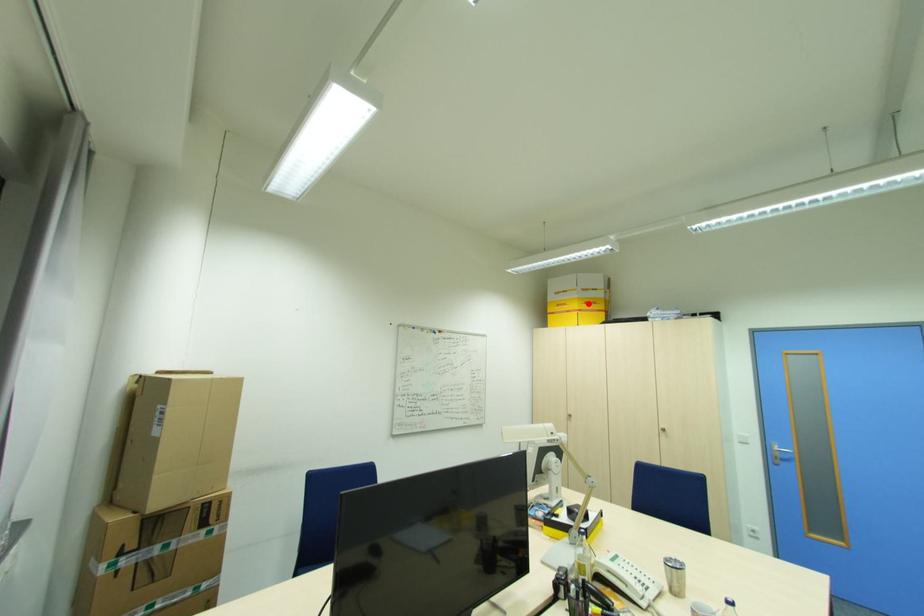
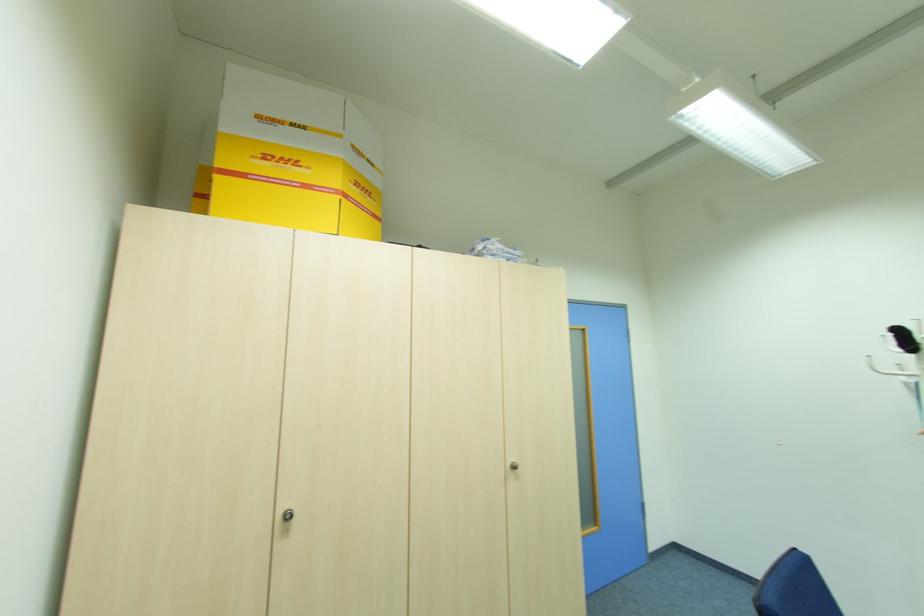
Locate, in the second image, the point that corresponds to the highlighted location in the first image.

(359, 185)